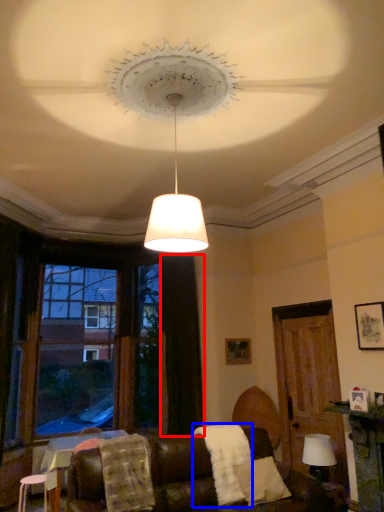
Question: Which object is closer to the camera taking this photo, curtain (highlighted by a red box) or blanket (highlighted by a blue box)?

Choices:
 (A) curtain
 (B) blanket

Answer: (B)